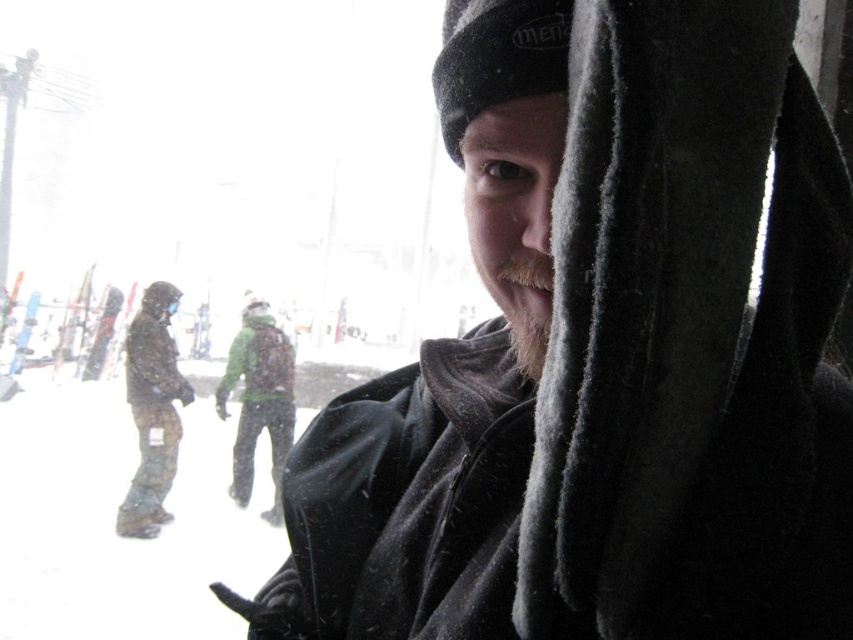
In the scene shown: Measure the distance between point (113, 568) and camera.

Point (113, 568) is 5.03 meters away from camera.

Can you confirm if camouflage-patterned snowboard at center is positioned to the right of camouflage snow pants at left?

Yes, camouflage-patterned snowboard at center is to the right of camouflage snow pants at left.

Which is in front, point (13, 529) or point (173, 342)?

Point (13, 529) is in front.

Locate an element on the screen. camouflage-patterned snowboard at center is located at coordinates (113, 524).

Can you confirm if fuzzy black scarf at center is taller than beige fuzzy beard at center?

Correct, fuzzy black scarf at center is much taller as beige fuzzy beard at center.

Can you confirm if fuzzy black scarf at center is positioned above beige fuzzy beard at center?

Actually, fuzzy black scarf at center is below beige fuzzy beard at center.

Image resolution: width=853 pixels, height=640 pixels. What do you see at coordinates (602, 355) in the screenshot?
I see `fuzzy black scarf at center` at bounding box center [602, 355].

At what (x,y) coordinates should I click in order to perform the action: click on fuzzy black scarf at center. Please return your answer as a coordinate pair (x, y). Looking at the image, I should click on (602, 355).

Is camouflage snow pants at left to the right of beige fuzzy beard at center from the viewer's perspective?

In fact, camouflage snow pants at left is to the left of beige fuzzy beard at center.

Is point (137, 355) in front of point (548, 317)?

No, (137, 355) is behind (548, 317).

Where is `camouflage snow pants at left`? Image resolution: width=853 pixels, height=640 pixels. camouflage snow pants at left is located at coordinates 152,410.

The height and width of the screenshot is (640, 853). Identify the location of camouflage snow pants at left. (152, 410).